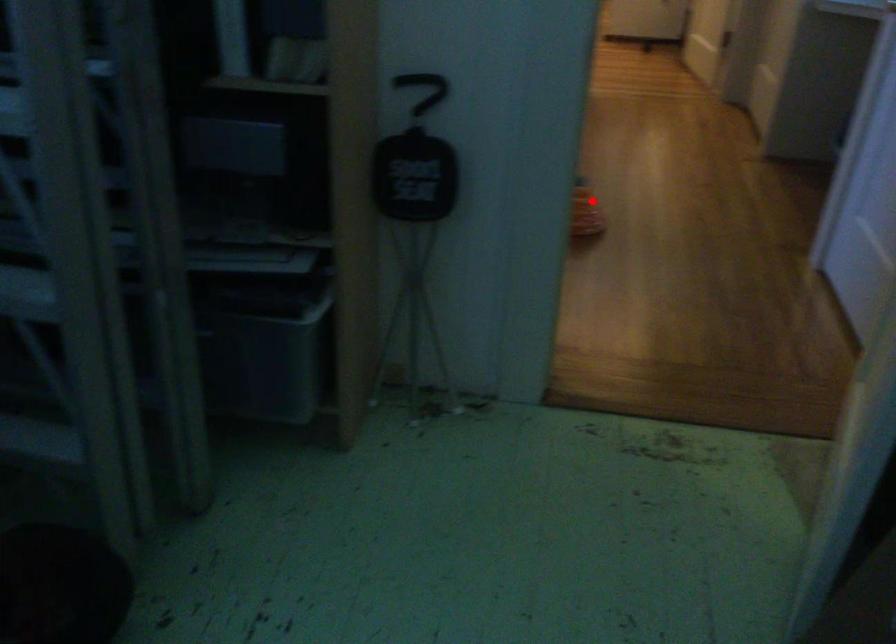
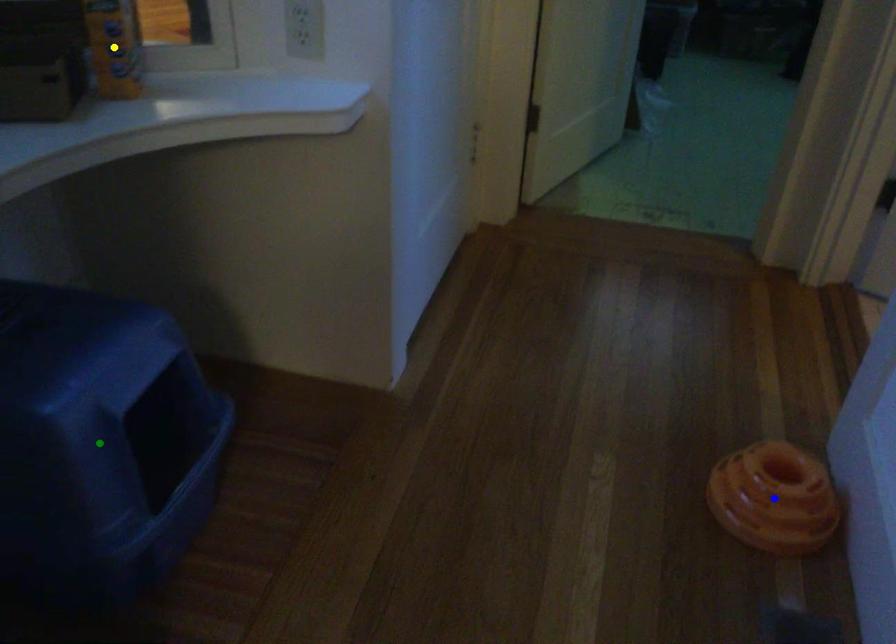
Question: I am providing you with two images of the same scene from different viewpoints. A red point is marked on the first image. You are given multiple points on the second image. In image 2, which mark is for the same physical point as the one in image 1?

Choices:
 (A) green point
 (B) blue point
 (C) yellow point

Answer: (B)